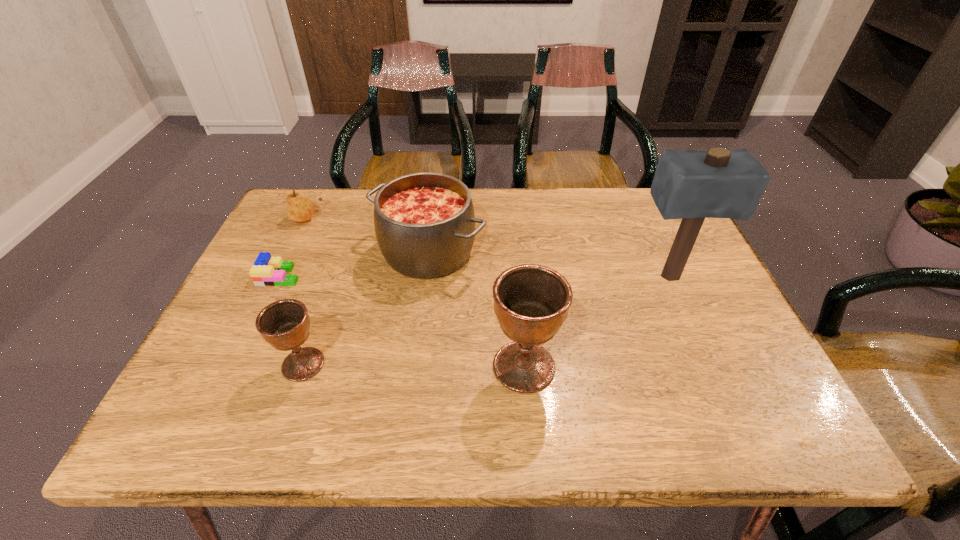
Find the location of a particular element. the fourth object from right to left is located at coordinates (284, 324).

Locate an element on the screen. The image size is (960, 540). the shorter chalice is located at coordinates (284, 324).

Image resolution: width=960 pixels, height=540 pixels. Find the location of `the taller chalice`. the taller chalice is located at coordinates (531, 302).

I want to click on the fifth shortest object, so click(x=531, y=302).

Find the location of a particular element. This screenshot has width=960, height=540. pear is located at coordinates (299, 208).

At what (x,y) coordinates should I click in order to perform the action: click on the third object from right to left. Please return your answer as a coordinate pair (x, y). The image size is (960, 540). Looking at the image, I should click on (424, 222).

At what (x,y) coordinates should I click in order to perform the action: click on the shortest object. Please return your answer as a coordinate pair (x, y). This screenshot has width=960, height=540. Looking at the image, I should click on (266, 271).

Identify the location of mallet. Image resolution: width=960 pixels, height=540 pixels. (690, 185).

Locate an element on the screen. This screenshot has height=540, width=960. the rightmost object is located at coordinates (690, 185).

Where is `vacant area situated 0.350m on the back of the left chalice`? The width and height of the screenshot is (960, 540). vacant area situated 0.350m on the back of the left chalice is located at coordinates (345, 242).